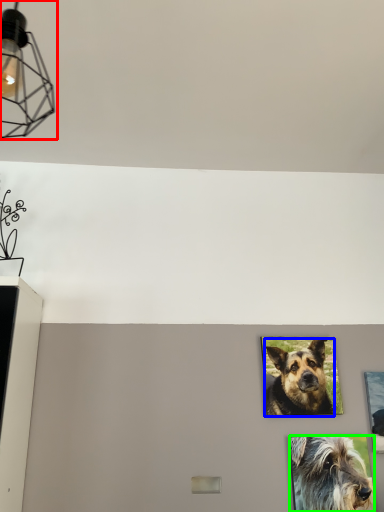
Question: Considering the real-world distances, which object is farthest from light fixture (highlighted by a red box)? dog (highlighted by a blue box) or dog (highlighted by a green box)?

Choices:
 (A) dog
 (B) dog

Answer: (B)